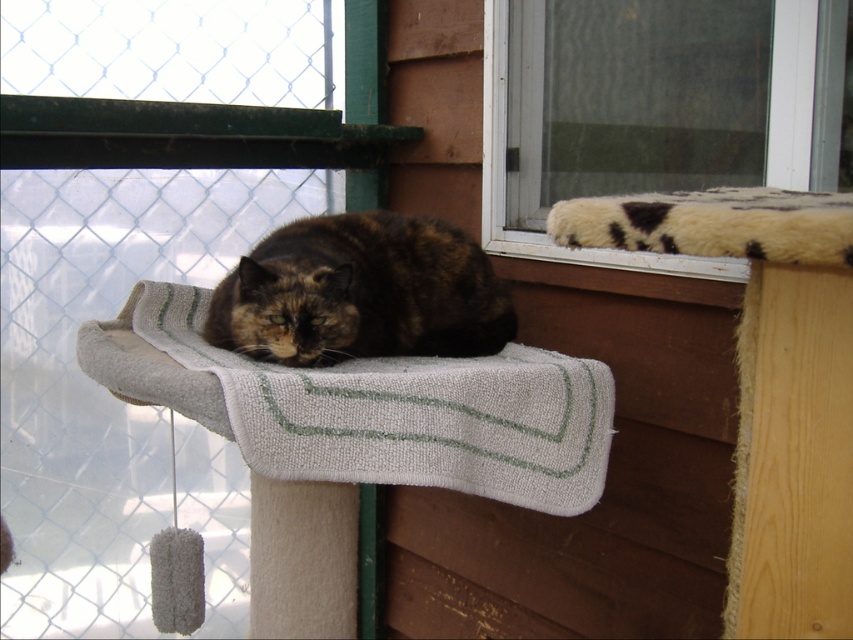
Is white textured mat at center below dark tortoiseshell fur at center?

Yes, white textured mat at center is below dark tortoiseshell fur at center.

Which is in front, point (442, 422) or point (432, 353)?

Point (442, 422) is more forward.

Where is `white textured mat at center`? white textured mat at center is located at coordinates (369, 406).

Can you confirm if fuzzy white cushion at upper right is bigger than dark tortoiseshell fur at center?

Result: Yes.

Between fuzzy white cushion at upper right and dark tortoiseshell fur at center, which one appears on the right side from the viewer's perspective?

fuzzy white cushion at upper right

Is point (804, 172) farther from camera compared to point (321, 243)?

No.

Identify the location of fuzzy white cushion at upper right. (654, 109).

Can you confirm if fuzzy white cushion at upper right is positioned to the right of white textured mat at center?

Yes, fuzzy white cushion at upper right is to the right of white textured mat at center.

Between fuzzy white cushion at upper right and white textured mat at center, which one appears on the right side from the viewer's perspective?

fuzzy white cushion at upper right

Is point (505, 241) farther from camera compared to point (148, 362)?

Yes, point (505, 241) is farther from viewer.

The width and height of the screenshot is (853, 640). I want to click on fuzzy white cushion at upper right, so click(654, 109).